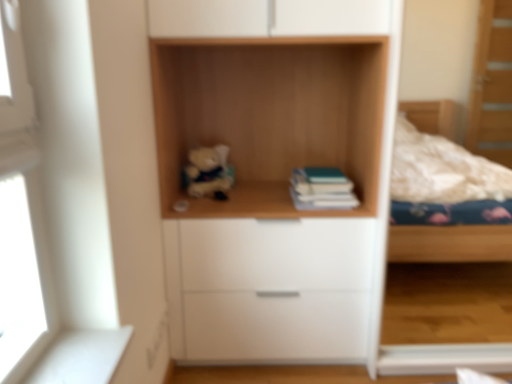
Find the location of a particular element. This screenshot has width=512, height=384. vacant region to the left of teal matte book at center is located at coordinates coord(259,198).